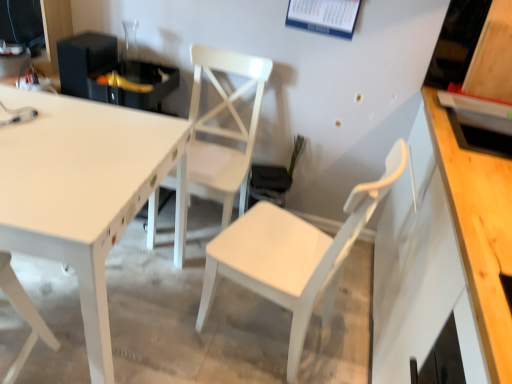
Measure the distance between white matte chair at center, the second chair from the left, and camera.

The distance of white matte chair at center, the second chair from the left, from camera is 1.90 meters.

Where is `white glossy table at upper left`? white glossy table at upper left is located at coordinates (81, 199).

Image resolution: width=512 pixels, height=384 pixels. In order to click on white matte chair at center, which is the 2th chair from right to left in this screenshot , I will do `click(223, 129)`.

Is white glossy table at upper left at the right side of white matte chair at lower left, which appears as the 1th chair when viewed from the left?

In fact, white glossy table at upper left is to the left of white matte chair at lower left, which appears as the 1th chair when viewed from the left.

Between white glossy table at upper left and white matte chair at lower left, which appears as the 3th chair when viewed from the right, which one has larger width?

white glossy table at upper left is wider.

Is white glossy table at upper left directly adjacent to white matte chair at lower left, which appears as the 1th chair when viewed from the left?

No, white glossy table at upper left is not beside white matte chair at lower left, which appears as the 1th chair when viewed from the left.

Is white matte chair at center, which ranks as the first chair in right-to-left order, in contact with white glossy table at upper left?

No, white matte chair at center, which ranks as the first chair in right-to-left order, is not beside white glossy table at upper left.

Is point (291, 258) positioned after point (100, 131)?

Yes.

Between white matte chair at center, which ranks as the first chair in right-to-left order, and white glossy table at upper left, which one has larger width?

With larger width is white glossy table at upper left.

Considering the relative sizes of white matte chair at center, which ranks as the first chair in right-to-left order, and white glossy table at upper left in the image provided, is white matte chair at center, which ranks as the first chair in right-to-left order, bigger than white glossy table at upper left?

Incorrect, white matte chair at center, which ranks as the first chair in right-to-left order, is not larger than white glossy table at upper left.

Is point (251, 142) closer to viewer compared to point (84, 298)?

No, it is behind (84, 298).

Would you say white glossy table at upper left is part of white matte chair at center, which is the 2th chair from right to left,'s contents?

No, white glossy table at upper left is located outside of white matte chair at center, which is the 2th chair from right to left.

From the image's perspective, which one is positioned lower, white matte chair at center, which is the 2th chair from right to left, or white glossy table at upper left?

white glossy table at upper left.

Which of these two, white matte chair at center, the second chair from the left, or white glossy table at upper left, stands shorter?

white glossy table at upper left is shorter.

Is white matte chair at center, the second chair from the left, turned away from white matte chair at lower left, which appears as the 1th chair when viewed from the left?

No, white matte chair at lower left, which appears as the 1th chair when viewed from the left, is not at the back of white matte chair at center, the second chair from the left.

Which is more to the right, white matte chair at center, which is the 2th chair from right to left, or white matte chair at lower left, which appears as the 1th chair when viewed from the left?

From the viewer's perspective, white matte chair at center, which is the 2th chair from right to left, appears more on the right side.

Between point (190, 119) and point (13, 368), which one is positioned behind?

The point (190, 119) is more distant.

In the scene shown: From their relative heights in the image, would you say white matte chair at center, which is the 2th chair from right to left, is taller or shorter than white matte chair at lower left, which appears as the 1th chair when viewed from the left?

Clearly, white matte chair at center, which is the 2th chair from right to left, is taller compared to white matte chair at lower left, which appears as the 1th chair when viewed from the left.

What's the angular difference between white glossy table at upper left and white matte chair at center, which is counted as the 3th chair, starting from the left,'s facing directions?

They differ by 110 degrees in their facing directions.

Considering the relative sizes of white glossy table at upper left and white matte chair at center, which ranks as the first chair in right-to-left order, in the image provided, is white glossy table at upper left bigger than white matte chair at center, which ranks as the first chair in right-to-left order,?

Yes, white glossy table at upper left is bigger than white matte chair at center, which ranks as the first chair in right-to-left order.

Which is less distant, [74,252] or [308,282]?

Point [74,252]

Which object is wider, white glossy table at upper left or white matte chair at center, which is counted as the 3th chair, starting from the left?

white glossy table at upper left.

Considering the positions of objects white matte chair at lower left, which appears as the 3th chair when viewed from the right, and white matte chair at center, which ranks as the first chair in right-to-left order, in the image provided, who is behind, white matte chair at lower left, which appears as the 3th chair when viewed from the right, or white matte chair at center, which ranks as the first chair in right-to-left order,?

white matte chair at center, which ranks as the first chair in right-to-left order, is behind.

Can you confirm if white matte chair at lower left, which appears as the 1th chair when viewed from the left, is bigger than white matte chair at center, which ranks as the first chair in right-to-left order?

No, white matte chair at lower left, which appears as the 1th chair when viewed from the left, is not bigger than white matte chair at center, which ranks as the first chair in right-to-left order.

Is white matte chair at center, which is counted as the 3th chair, starting from the left, located within white matte chair at lower left, which appears as the 3th chair when viewed from the right?

That's incorrect, white matte chair at center, which is counted as the 3th chair, starting from the left, is not inside white matte chair at lower left, which appears as the 3th chair when viewed from the right.

Is white matte chair at lower left, which appears as the 1th chair when viewed from the left, oriented towards white matte chair at center, which ranks as the first chair in right-to-left order?

No, white matte chair at lower left, which appears as the 1th chair when viewed from the left, is not turned towards white matte chair at center, which ranks as the first chair in right-to-left order.

Does white glossy table at upper left have a greater width compared to white matte chair at center, the second chair from the left?

Yes.

How much distance is there between white glossy table at upper left and white matte chair at center, the second chair from the left?

They are 19.55 inches apart.

Considering the positions of objects white glossy table at upper left and white matte chair at center, which is the 2th chair from right to left, in the image provided, who is behind, white glossy table at upper left or white matte chair at center, which is the 2th chair from right to left,?

white matte chair at center, which is the 2th chair from right to left, is more distant.

You are a GUI agent. You are given a task and a screenshot of the screen. Output one action in this format:
    pyautogui.click(x=<x>, y=<y>)
    Task: Click on the table that appears behind the white matte chair at lower left, which appears as the 3th chair when viewed from the right
    The height and width of the screenshot is (384, 512).
    Given the screenshot: What is the action you would take?
    pyautogui.click(x=81, y=199)

There is a white glossy table at upper left. Identify the location of the 3rd chair above it (from a real-world perspective). (293, 255).

Based on the photo, estimate the real-world distances between objects in this image. Which object is further from white matte chair at center, which is counted as the 3th chair, starting from the left, white matte chair at center, which is the 2th chair from right to left, or white matte chair at lower left, which appears as the 1th chair when viewed from the left?

white matte chair at lower left, which appears as the 1th chair when viewed from the left, is further to white matte chair at center, which is counted as the 3th chair, starting from the left.

Considering their positions, is white glossy table at upper left positioned further to white matte chair at lower left, which appears as the 1th chair when viewed from the left, than white matte chair at center, the second chair from the left?

Among the two, white matte chair at center, the second chair from the left, is located further to white matte chair at lower left, which appears as the 1th chair when viewed from the left.

Which object lies nearer to the anchor point white matte chair at center, which ranks as the first chair in right-to-left order, white glossy table at upper left or white matte chair at center, which is the 2th chair from right to left?

white glossy table at upper left is positioned closer to the anchor white matte chair at center, which ranks as the first chair in right-to-left order.

When comparing their distances from white matte chair at lower left, which appears as the 3th chair when viewed from the right, does white matte chair at center, the second chair from the left, or white matte chair at center, which is counted as the 3th chair, starting from the left, seem closer?

white matte chair at center, which is counted as the 3th chair, starting from the left, is positioned closer to the anchor white matte chair at lower left, which appears as the 3th chair when viewed from the right.

Based on their spatial positions, is white matte chair at center, which is the 2th chair from right to left, or white matte chair at center, which is counted as the 3th chair, starting from the left, closer to white glossy table at upper left?

Based on the image, white matte chair at center, which is the 2th chair from right to left, appears to be nearer to white glossy table at upper left.

From the image, which object appears to be nearer to white matte chair at lower left, which appears as the 3th chair when viewed from the right, white glossy table at upper left or white matte chair at center, which ranks as the first chair in right-to-left order?

white glossy table at upper left is closer to white matte chair at lower left, which appears as the 3th chair when viewed from the right.

Looking at the image, which one is located further to white matte chair at center, which is the 2th chair from right to left, white glossy table at upper left or white matte chair at center, which is counted as the 3th chair, starting from the left?

white matte chair at center, which is counted as the 3th chair, starting from the left.

Which object lies nearer to the anchor point white glossy table at upper left, white matte chair at center, which is counted as the 3th chair, starting from the left, or white matte chair at lower left, which appears as the 1th chair when viewed from the left?

white matte chair at lower left, which appears as the 1th chair when viewed from the left.

Identify the location of chair between white matte chair at lower left, which appears as the 1th chair when viewed from the left, and white matte chair at center, which is counted as the 3th chair, starting from the left, in the horizontal direction. This screenshot has width=512, height=384. (223, 129).

The height and width of the screenshot is (384, 512). In order to click on table between white matte chair at lower left, which appears as the 1th chair when viewed from the left, and white matte chair at center, the second chair from the left, in the front-back direction in this screenshot , I will do `click(81, 199)`.